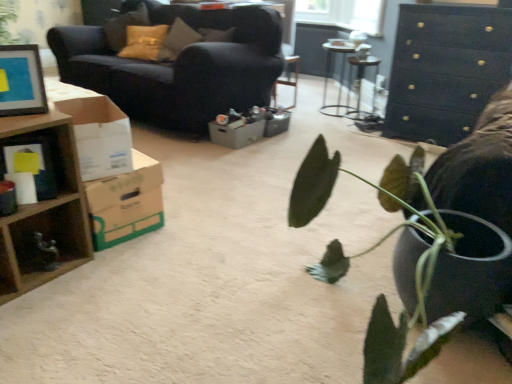
Question: Is wooden box at left bigger than matte black picture frame at upper left?

Choices:
 (A) no
 (B) yes

Answer: (A)

Question: Can you confirm if wooden box at left is positioned to the right of matte black picture frame at upper left?

Choices:
 (A) no
 (B) yes

Answer: (B)

Question: Is wooden box at left far from matte black picture frame at upper left?

Choices:
 (A) no
 (B) yes

Answer: (A)

Question: Is wooden box at left located outside matte black picture frame at upper left?

Choices:
 (A) no
 (B) yes

Answer: (B)

Question: Does wooden box at left have a smaller size compared to matte black picture frame at upper left?

Choices:
 (A) yes
 (B) no

Answer: (A)

Question: From the image's perspective, would you say wooden box at left is positioned over matte black picture frame at upper left?

Choices:
 (A) yes
 (B) no

Answer: (B)

Question: Is brown cardboard box at left, the 2th cardboard box from the back, oriented towards metallic silver table at center, which ranks as the 1th table in right-to-left order?

Choices:
 (A) no
 (B) yes

Answer: (B)

Question: Is brown cardboard box at left, the second cardboard box in the front-to-back sequence, positioned in front of metallic silver table at center, the 2th table positioned from the left?

Choices:
 (A) no
 (B) yes

Answer: (B)

Question: From a real-world perspective, is brown cardboard box at left, the second cardboard box in the front-to-back sequence, on metallic silver table at center, which ranks as the 1th table in right-to-left order?

Choices:
 (A) yes
 (B) no

Answer: (B)

Question: Can metallic silver table at center, the 2th table positioned from the left, be found inside brown cardboard box at left, the second cardboard box in the front-to-back sequence?

Choices:
 (A) no
 (B) yes

Answer: (A)

Question: Is brown cardboard box at left, the 2th cardboard box from the back, not near metallic silver table at center, the 2th table positioned from the left?

Choices:
 (A) no
 (B) yes

Answer: (B)

Question: Does brown cardboard box at left, the second cardboard box in the front-to-back sequence, have a greater width compared to metallic silver table at center, which ranks as the 1th table in right-to-left order?

Choices:
 (A) no
 (B) yes

Answer: (A)

Question: Is gray cardboard box at center, which ranks as the third cardboard box in front-to-back order, bigger than metallic silver table at center, which ranks as the 1th table in right-to-left order?

Choices:
 (A) yes
 (B) no

Answer: (B)